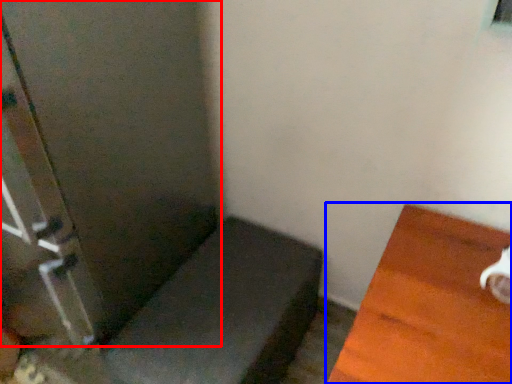
Question: Among these objects, which one is farthest to the camera, screen door (highlighted by a red box) or furniture (highlighted by a blue box)?

Choices:
 (A) screen door
 (B) furniture

Answer: (A)